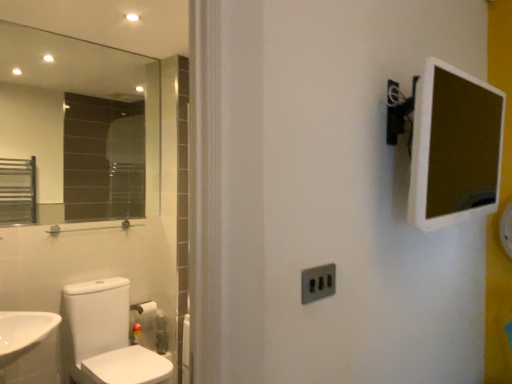
Question: In terms of width, does white glossy toilet at lower left look wider or thinner when compared to clear glass mirror at upper left?

Choices:
 (A) wide
 (B) thin

Answer: (A)

Question: Considering the positions of white glossy toilet at lower left and clear glass mirror at upper left in the image, is white glossy toilet at lower left bigger or smaller than clear glass mirror at upper left?

Choices:
 (A) small
 (B) big

Answer: (B)

Question: Based on their relative distances, which object is nearer to the white plastic mirror at upper right?

Choices:
 (A) white glossy toilet at lower left
 (B) clear glass mirror at upper left
 (C) satin silver switch at center

Answer: (C)

Question: Estimate the real-world distances between objects in this image. Which object is closer to the clear glass mirror at upper left?

Choices:
 (A) white glossy toilet at lower left
 (B) satin silver switch at center
 (C) white plastic mirror at upper right

Answer: (A)